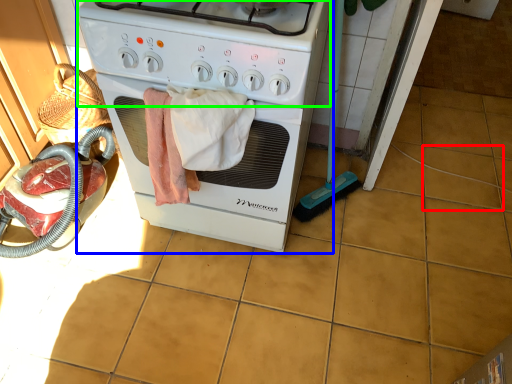
Question: Considering the real-world distances, which object is closest to tile (highlighted by a red box)? home appliance (highlighted by a blue box) or gas stove (highlighted by a green box).

Choices:
 (A) home appliance
 (B) gas stove

Answer: (A)